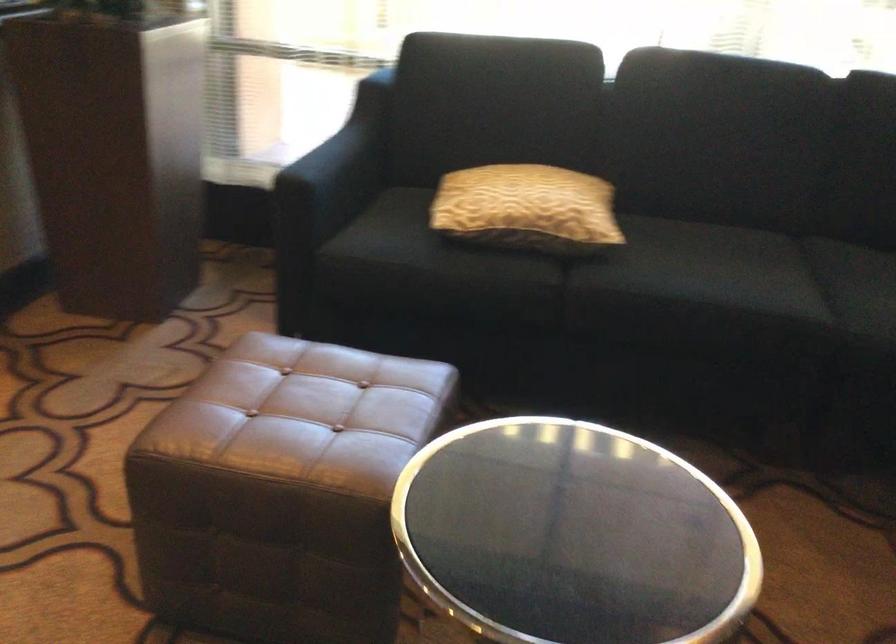
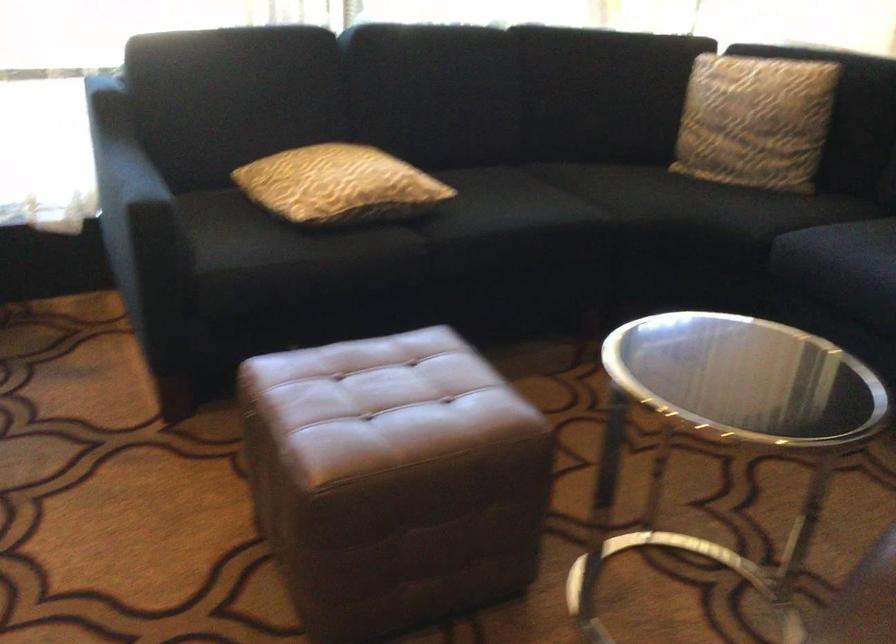
Question: I am providing you with two images of the same scene from different viewpoints. After the viewpoint changes to image2, which objects are now occluded?

Choices:
 (A) yellow patterned pillow
 (B) brown leather ottoman
 (C) sofa armrest
 (D) none of these

Answer: (D)